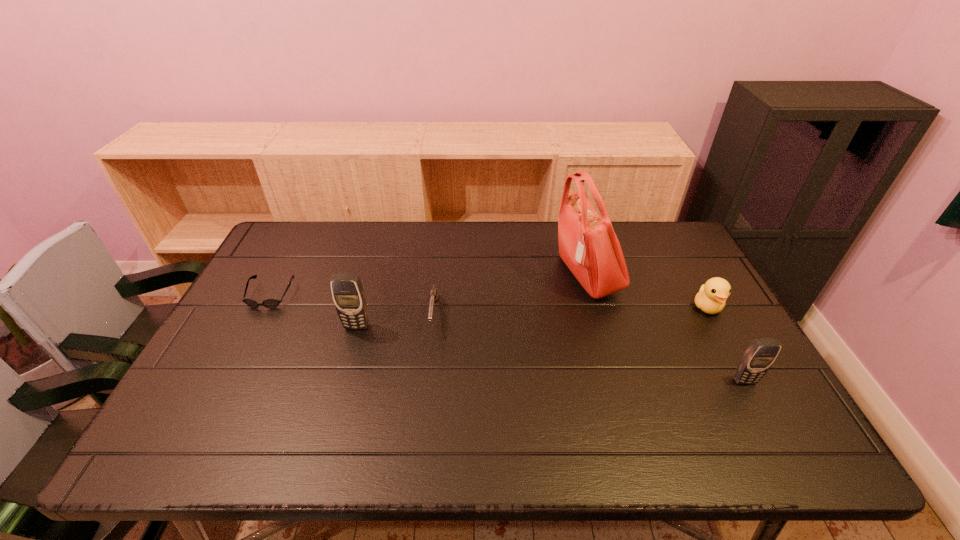
Locate an element on the screen. The width and height of the screenshot is (960, 540). free spot between the gun and the third shortest object is located at coordinates (570, 310).

Image resolution: width=960 pixels, height=540 pixels. What are the coordinates of `vacant point located between the fourth object from left to right and the nearest object` in the screenshot? It's located at click(665, 328).

Where is `free space that is in between the second object from left to right and the fourth tallest object`? free space that is in between the second object from left to right and the fourth tallest object is located at coordinates (532, 316).

Locate an element on the screen. vacant region between the handbag and the duck is located at coordinates (647, 291).

You are a GUI agent. You are given a task and a screenshot of the screen. Output one action in this format:
    pyautogui.click(x=<x>, y=<y>)
    Task: Click on the free space that is in between the third shortest object and the shortest object
    This screenshot has width=960, height=540.
    Given the screenshot: What is the action you would take?
    pyautogui.click(x=489, y=301)

Find the location of a particular element. Image resolution: width=960 pixels, height=540 pixels. vacant area that lies between the second tallest object and the handbag is located at coordinates (471, 301).

Locate an element on the screen. vacant area that lies between the fifth tallest object and the fourth tallest object is located at coordinates tap(570, 310).

The image size is (960, 540). What are the coordinates of `free space between the sunglasses and the handbag` in the screenshot? It's located at (428, 285).

Locate an element on the screen. This screenshot has height=540, width=960. empty location between the left cellular telephone and the shorter cellular telephone is located at coordinates (551, 354).

This screenshot has width=960, height=540. In order to click on free space between the duck and the right cellular telephone in this screenshot , I will do `click(726, 344)`.